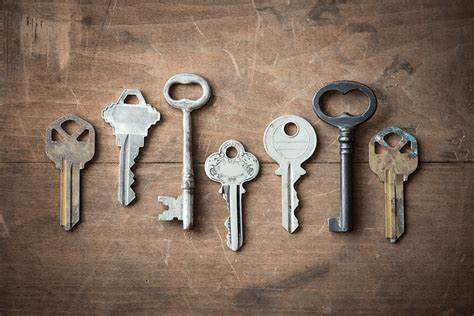
Where is `keys`? The image size is (474, 316). keys is located at coordinates (73, 152), (127, 125), (185, 159), (223, 159), (284, 147), (345, 123), (392, 149).